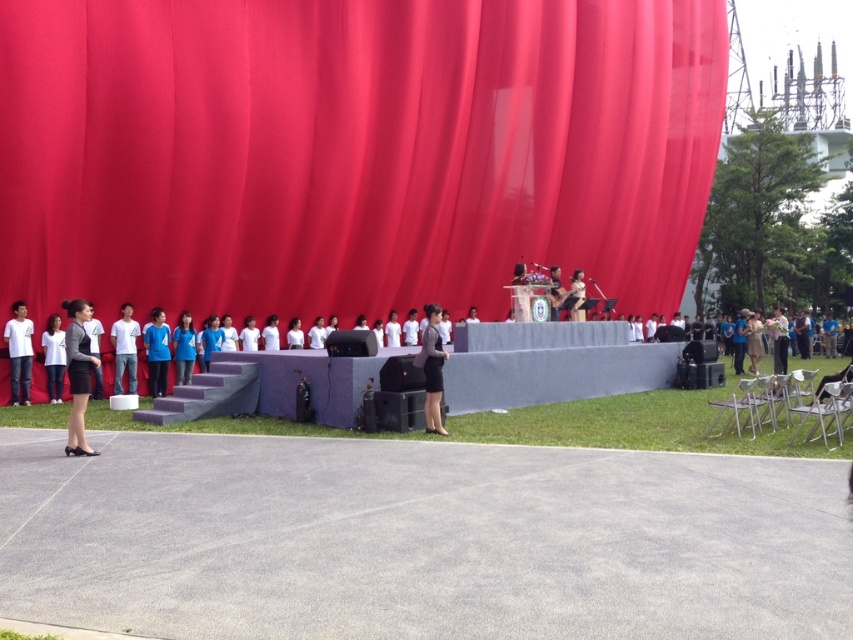
Where is `matte red curtain at center`? matte red curtain at center is located at coordinates (352, 148).

Which is in front, point (340, 108) or point (9, 403)?

Point (9, 403) is more forward.

Where is `matte red curtain at center`? matte red curtain at center is located at coordinates (352, 148).

Is white matte shirt at left to the left of black fabric at right from the viewer's perspective?

Indeed, white matte shirt at left is positioned on the left side of black fabric at right.

Does point (22, 384) come farther from viewer compared to point (770, 330)?

No, (22, 384) is in front of (770, 330).

Where is `white matte shirt at left`? white matte shirt at left is located at coordinates (19, 353).

Consider the image. How much distance is there between white matte shirt at center and black fabric at right?

A distance of 45.89 feet exists between white matte shirt at center and black fabric at right.

Which is in front, point (132, 332) or point (776, 364)?

Positioned in front is point (132, 332).

Where is `white matte shirt at center`? The width and height of the screenshot is (853, 640). white matte shirt at center is located at coordinates point(125,348).